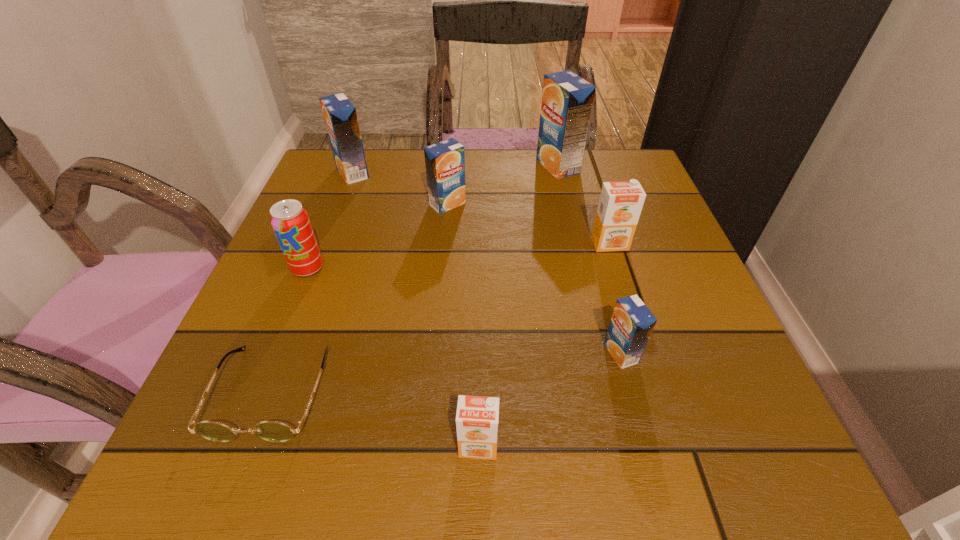
Where is `vacant region between the nearest blue orange_juice and the second biggest blue orange_juice`? The width and height of the screenshot is (960, 540). vacant region between the nearest blue orange_juice and the second biggest blue orange_juice is located at coordinates (487, 263).

Identify the location of vacant point located between the third farthest blue orange_juice and the bigger orange orange juice. The image size is (960, 540). (529, 224).

What are the coordinates of `free area in between the tallest object and the third farthest orange juice` in the screenshot? It's located at (503, 185).

You are a GUI agent. You are given a task and a screenshot of the screen. Output one action in this format:
    pyautogui.click(x=<x>, y=<y>)
    Task: Click on the unoccupied position between the shortest object and the soda can
    This screenshot has height=540, width=960.
    Given the screenshot: What is the action you would take?
    pyautogui.click(x=289, y=330)

The image size is (960, 540). I want to click on object that can be found as the closest to the smallest blue orange_juice, so click(477, 417).

Select which object appears as the seventh closest to the right orange orange juice. Please provide its 2D coordinates. Your answer should be formatted as a tuple, i.e. [(x, y)], where the tuple contains the x and y coordinates of a point satisfying the conditions above.

[(340, 116)]

In order to click on orange juice that stands as the fourth closest to the second nearest orange juice in this screenshot , I will do `click(567, 99)`.

This screenshot has width=960, height=540. I want to click on orange juice that is the third closest to the farther orange orange juice, so click(x=445, y=161).

You are a GUI agent. You are given a task and a screenshot of the screen. Output one action in this format:
    pyautogui.click(x=<x>, y=<y>)
    Task: Click on the blue orange_juice that is the closest to the second tallest object
    
    Given the screenshot: What is the action you would take?
    pyautogui.click(x=445, y=161)

Identify which blue orange_juice is located as the third nearest to the farther orange orange juice. Please provide its 2D coordinates. Your answer should be formatted as a tuple, i.e. [(x, y)], where the tuple contains the x and y coordinates of a point satisfying the conditions above.

[(445, 161)]